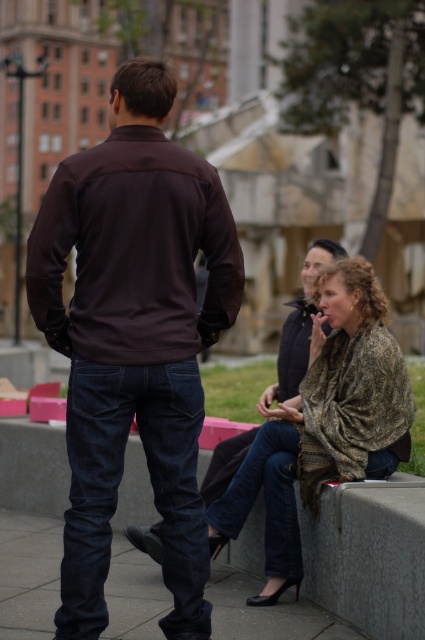
This screenshot has height=640, width=425. Describe the element at coordinates (133, 337) in the screenshot. I see `dark brown jersey at center` at that location.

Is dark brown jersey at center positioned at the back of smooth concrete pavement at lower center?

No, dark brown jersey at center is in front of smooth concrete pavement at lower center.

Does point (155, 80) come in front of point (283, 609)?

Yes.

This screenshot has width=425, height=640. I want to click on dark brown jersey at center, so click(133, 337).

The height and width of the screenshot is (640, 425). In order to click on camouflage fabric scarf at lower right in this screenshot , I will do `click(323, 422)`.

Can you confirm if camouflage fabric scarf at lower right is positioned below smooth concrete pavement at lower center?

No, camouflage fabric scarf at lower right is not below smooth concrete pavement at lower center.

Which is in front, point (311, 490) or point (3, 596)?

Positioned in front is point (311, 490).

Locate an element on the screen. The width and height of the screenshot is (425, 640). camouflage fabric scarf at lower right is located at coordinates (323, 422).

Which is more to the right, dark brown jersey at center or camouflage fabric scarf at lower right?

Positioned to the right is camouflage fabric scarf at lower right.

Who is lower down, dark brown jersey at center or camouflage fabric scarf at lower right?

camouflage fabric scarf at lower right

In order to click on dark brown jersey at center in this screenshot , I will do `click(133, 337)`.

The width and height of the screenshot is (425, 640). I want to click on dark brown jersey at center, so click(133, 337).